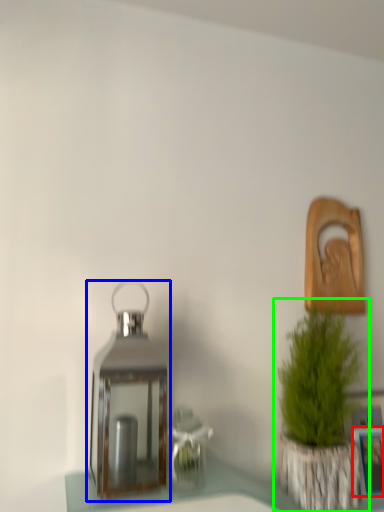
Question: Which object is positioned farthest from picture frame (highlighted by a red box)? Select from lantern (highlighted by a blue box) and houseplant (highlighted by a green box).

Choices:
 (A) lantern
 (B) houseplant

Answer: (A)